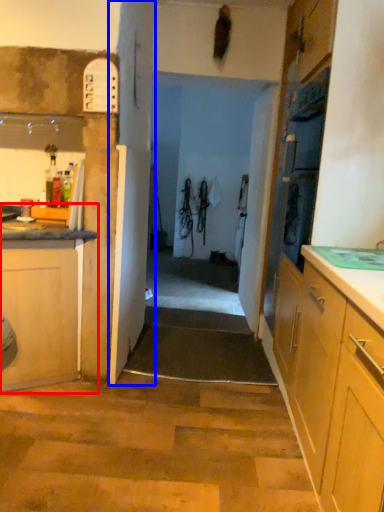
Question: Which object is further to the camera taking this photo, cabinetry (highlighted by a red box) or door (highlighted by a blue box)?

Choices:
 (A) cabinetry
 (B) door

Answer: (B)